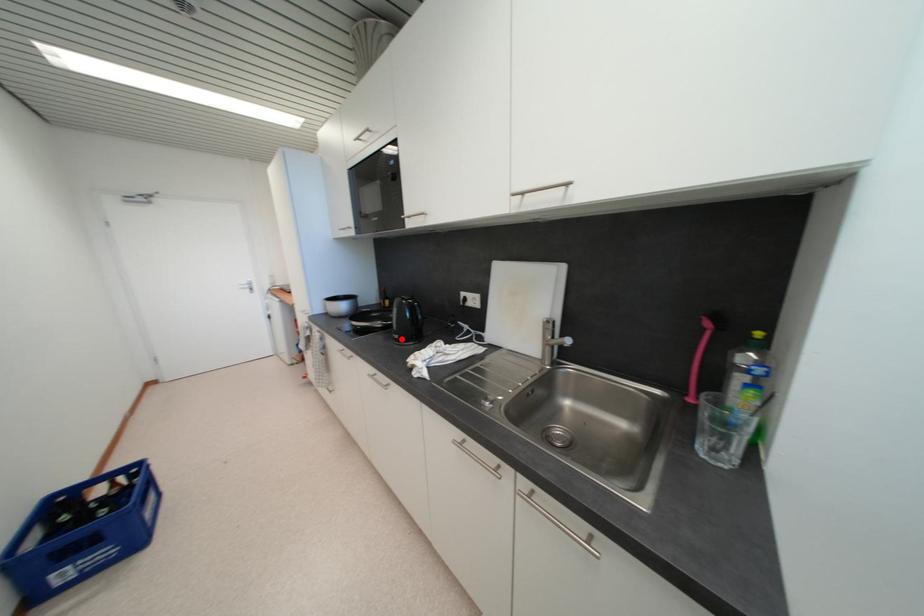
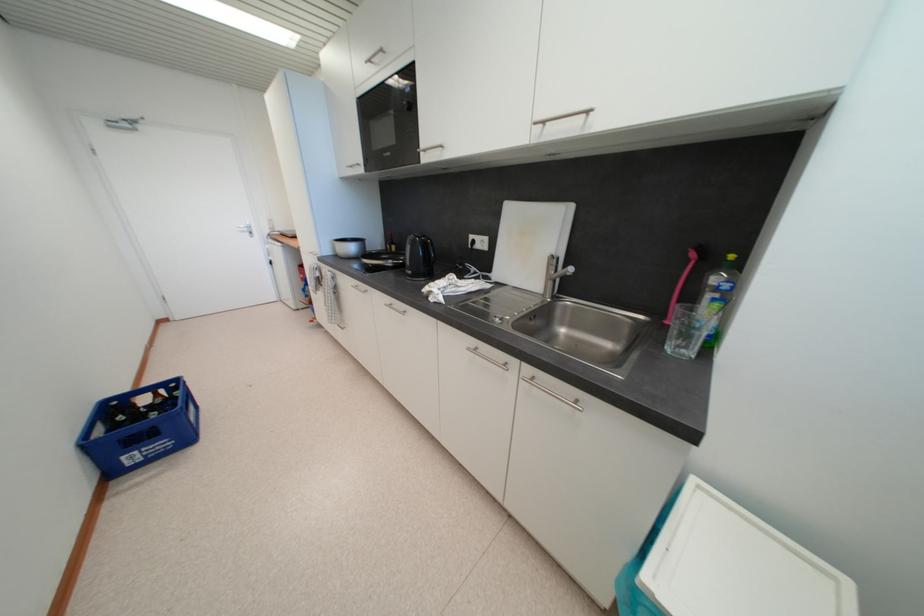
Locate, in the second image, the point that corresponds to the highlighted location in the first image.

(415, 275)